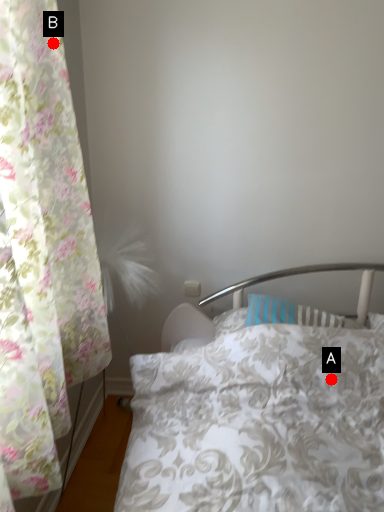
Question: Two points are circled on the image, labeled by A and B beside each circle. Among these points, which one is farthest from the camera?

Choices:
 (A) A is further
 (B) B is further

Answer: (A)